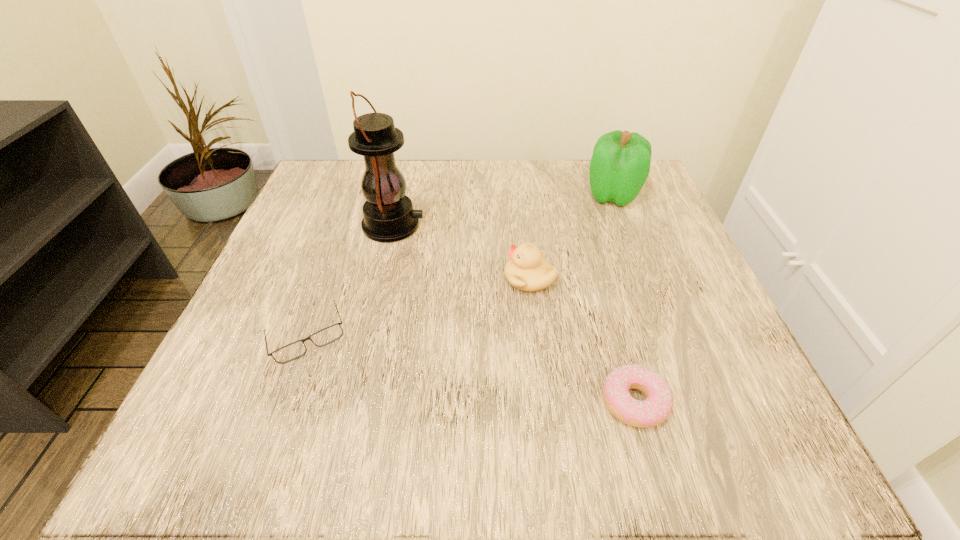
The width and height of the screenshot is (960, 540). What are the coordinates of `vacant area that lies between the bell pepper and the second nearest object` in the screenshot? It's located at (460, 266).

Locate an element on the screen. The height and width of the screenshot is (540, 960). vacant area that lies between the spectacles and the third nearest object is located at coordinates (419, 308).

Identify the location of vacant region between the lantern and the spectacles. The image size is (960, 540). pos(350,281).

Where is `free spot between the spectacles and the third object from left to right`? The image size is (960, 540). free spot between the spectacles and the third object from left to right is located at coordinates (419, 308).

In order to click on vacant point located between the nearest object and the fourth shortest object in this screenshot , I will do `click(623, 299)`.

This screenshot has width=960, height=540. I want to click on vacant area that lies between the bell pepper and the nearest object, so [x=623, y=299].

The image size is (960, 540). In order to click on unoccupied area between the bell pepper and the third nearest object in this screenshot , I will do `click(571, 237)`.

At what (x,y) coordinates should I click in order to perform the action: click on free space between the bell pepper and the doughnut. Please return your answer as a coordinate pair (x, y). Looking at the image, I should click on (623, 299).

Find the location of a particular element. This screenshot has width=960, height=540. free spot between the bell pepper and the tallest object is located at coordinates (503, 210).

The height and width of the screenshot is (540, 960). In order to click on object that is the fourth closest to the nearest object in this screenshot , I will do `click(388, 216)`.